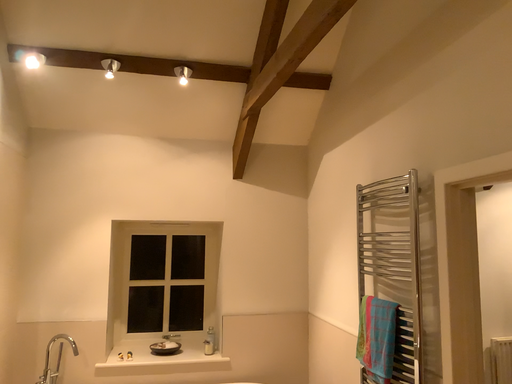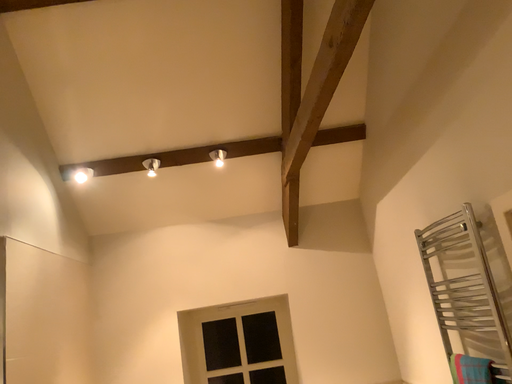
Question: How did the camera likely rotate when shooting the video?

Choices:
 (A) rotated right
 (B) rotated left

Answer: (B)